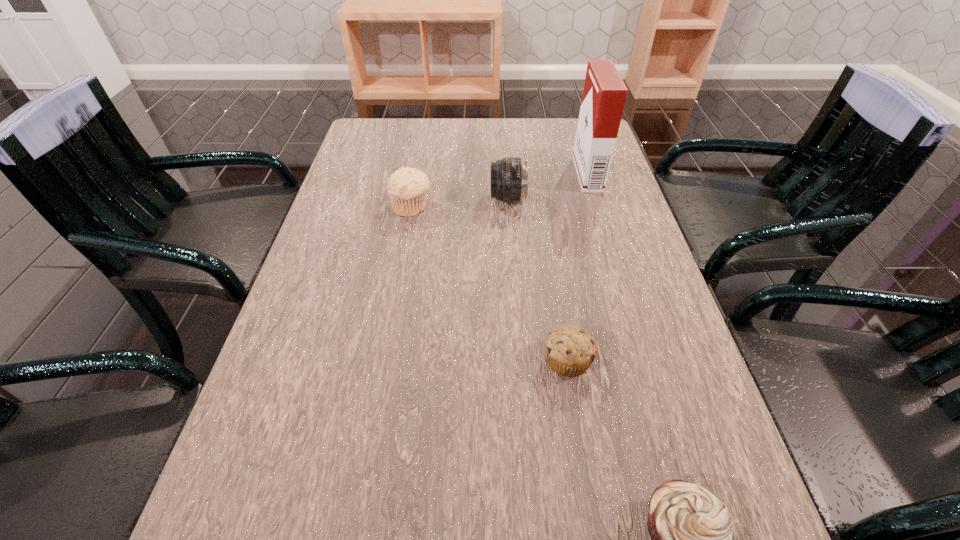
Where is `object that can be found as the closest to the telephoto lens`? The height and width of the screenshot is (540, 960). object that can be found as the closest to the telephoto lens is located at coordinates (407, 187).

Select which muffin is the closest to the second farthest muffin. Please provide its 2D coordinates. Your answer should be formatted as a tuple, i.e. [(x, y)], where the tuple contains the x and y coordinates of a point satisfying the conditions above.

[(691, 530)]

Identify the location of the closest muffin relative to the nearest muffin. This screenshot has width=960, height=540. (570, 350).

Image resolution: width=960 pixels, height=540 pixels. Identify the location of free spot that satisfies the following two spatial constraints: 1. on the front-facing side of the tallest object; 2. on the front side of the tallest muffin. (598, 207).

The image size is (960, 540). In order to click on vacant space that satisfies the following two spatial constraints: 1. on the back side of the second muffin from left to right; 2. at the front element of the telephoto lens in this screenshot , I will do `click(541, 199)`.